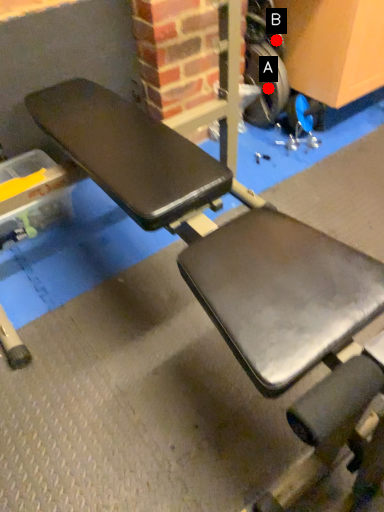
Question: Two points are circled on the image, labeled by A and B beside each circle. Which point appears closest to the camera in this image?

Choices:
 (A) A is closer
 (B) B is closer

Answer: (A)